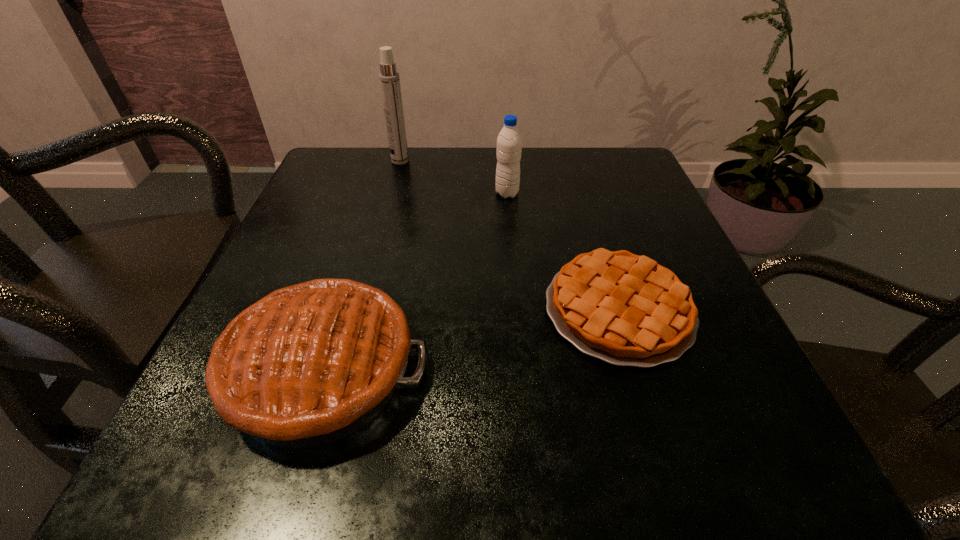
Where is `free space at the far edge of the desktop`? free space at the far edge of the desktop is located at coordinates (464, 172).

The image size is (960, 540). Identify the location of vacant space at the left edge. (256, 287).

Identify the location of vacant space at the right edge. (725, 359).

In the image, there is a desktop. At what (x,y) coordinates should I click in order to perform the action: click on vacant space at the far left corner. Please return your answer as a coordinate pair (x, y). The image size is (960, 540). Looking at the image, I should click on 359,171.

The image size is (960, 540). I want to click on vacant space at the near left corner, so click(187, 476).

I want to click on vacant point located between the shortest object and the second shortest object, so click(x=470, y=340).

Locate an element on the screen. The width and height of the screenshot is (960, 540). unoccupied area between the shortest object and the left pie is located at coordinates (470, 340).

Where is `free area in between the left pie and the third shortest object`? Image resolution: width=960 pixels, height=540 pixels. free area in between the left pie and the third shortest object is located at coordinates (415, 282).

Locate an element on the screen. This screenshot has width=960, height=540. free spot between the shortest object and the aerosol can is located at coordinates (510, 235).

At what (x,y) coordinates should I click in order to perform the action: click on free area in between the water bottle and the shorter pie. Please return your answer as a coordinate pair (x, y). This screenshot has height=540, width=960. Looking at the image, I should click on (563, 252).